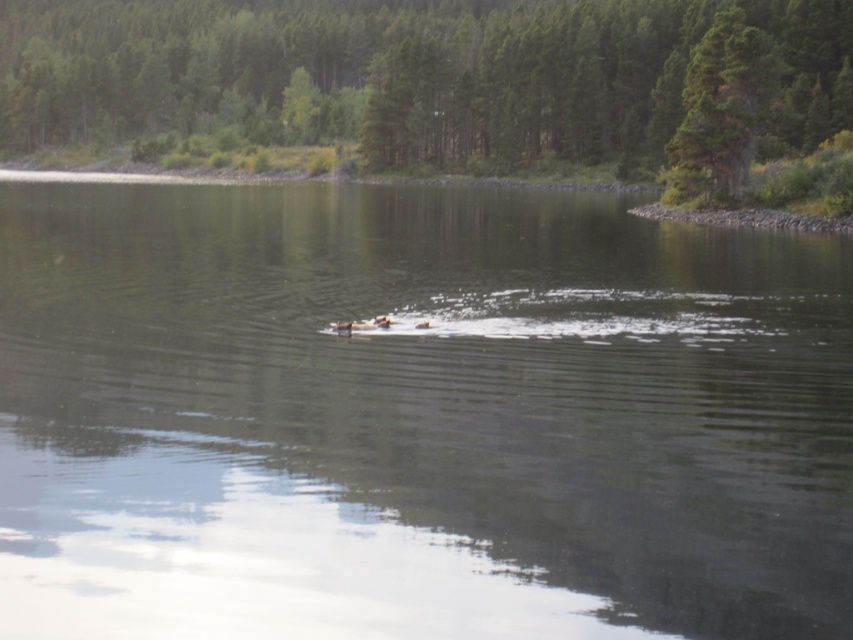
Question: Is clear water at center closer to the viewer compared to green textured tree at upper center?

Choices:
 (A) yes
 (B) no

Answer: (A)

Question: Is clear water at center to the right of green textured tree at upper center from the viewer's perspective?

Choices:
 (A) yes
 (B) no

Answer: (A)

Question: Which object appears closest to the camera in this image?

Choices:
 (A) green textured tree at upper center
 (B) clear water at center

Answer: (B)

Question: Is the position of clear water at center more distant than that of green textured tree at upper center?

Choices:
 (A) yes
 (B) no

Answer: (B)